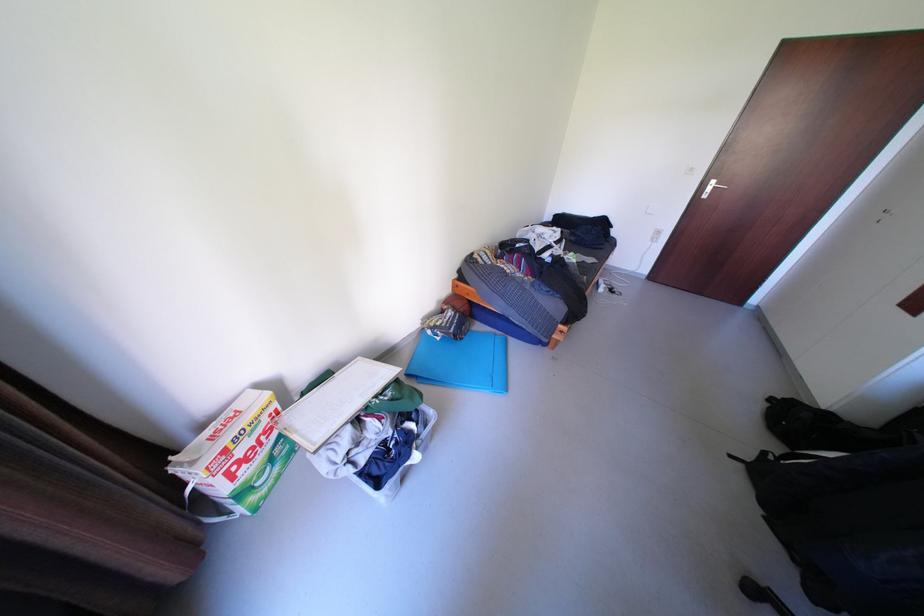
The height and width of the screenshot is (616, 924). What do you see at coordinates (655, 235) in the screenshot?
I see `a white light switch` at bounding box center [655, 235].